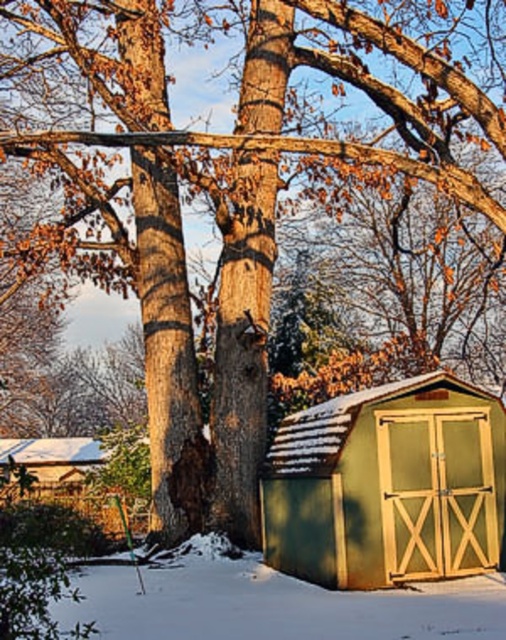
Question: Which point is closer to the camera taking this photo?

Choices:
 (A) (131, 522)
 (B) (426, 490)

Answer: (B)

Question: Does green wood shed at lower right come in front of green wooden shed at lower left?

Choices:
 (A) yes
 (B) no

Answer: (A)

Question: Is green wood shed at lower right below green wooden shed at lower left?

Choices:
 (A) no
 (B) yes

Answer: (A)

Question: Which of the following is the farthest from the observer?

Choices:
 (A) (56, 452)
 (B) (356, 557)

Answer: (A)

Question: Which point is farther to the camera?

Choices:
 (A) (5, 442)
 (B) (444, 435)

Answer: (A)

Question: From the image, what is the correct spatial relationship of green wood shed at lower right in relation to green wooden shed at lower left?

Choices:
 (A) right
 (B) left

Answer: (A)